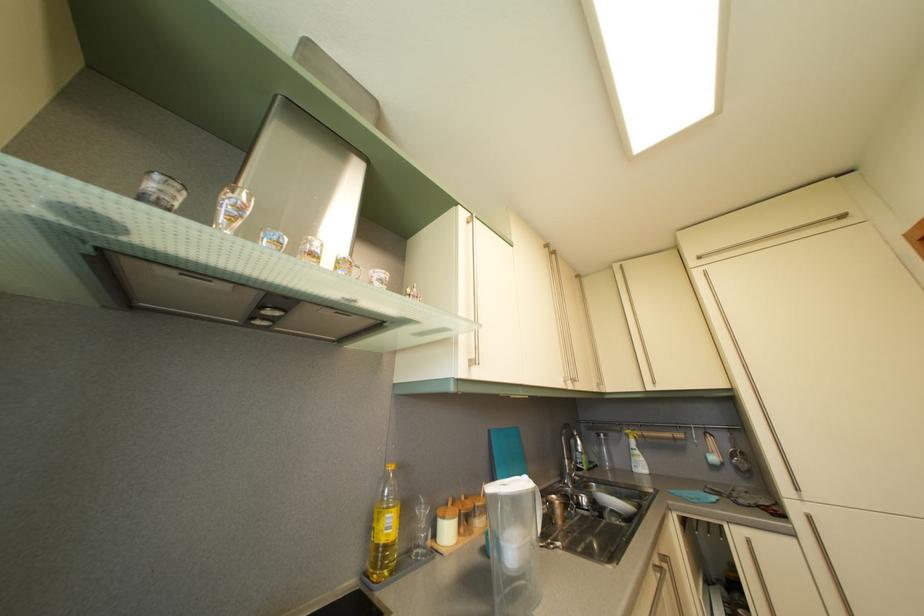
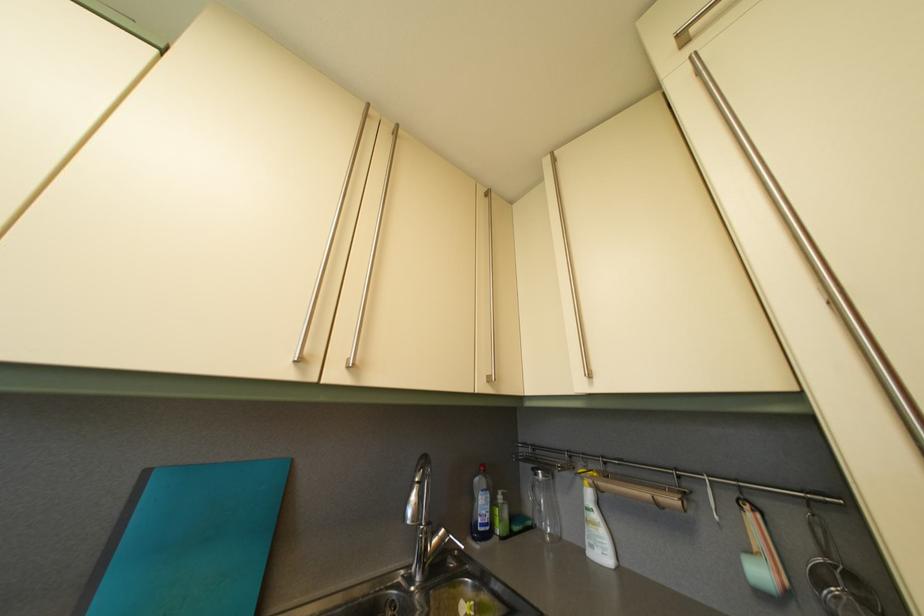
The point at (x=636, y=443) is marked in the first image. Where is the corresponding point in the second image?

(590, 485)